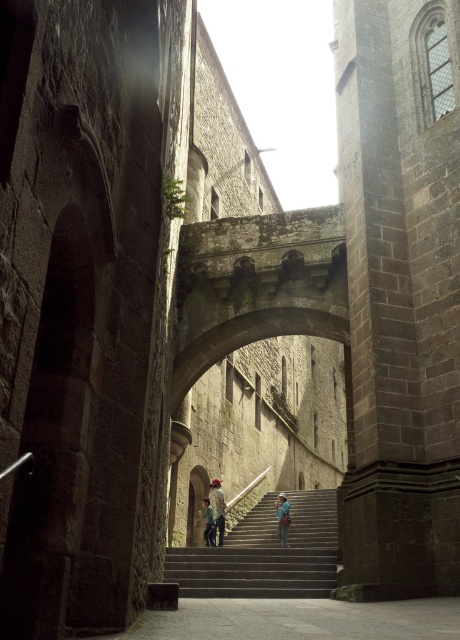
Where is `light blue denim jeans at center`? The image size is (460, 640). light blue denim jeans at center is located at coordinates (218, 508).

Who is more distant from viewer, (214, 516) or (280, 524)?

The point (280, 524) is more distant.

Locate an element on the screen. This screenshot has width=460, height=640. light blue denim jeans at center is located at coordinates (218, 508).

Which is behind, point (216, 531) or point (212, 541)?

The point (216, 531) is more distant.

How far apart are light blue denim jeans at center and green fabric child at center?

light blue denim jeans at center and green fabric child at center are 94.54 centimeters apart from each other.

What do you see at coordinates (218, 508) in the screenshot?
I see `light blue denim jeans at center` at bounding box center [218, 508].

Where is `light blue denim jeans at center`? The height and width of the screenshot is (640, 460). light blue denim jeans at center is located at coordinates (218, 508).

Who is lower down, stone textured stairs at center or blue denim jeans at center?

stone textured stairs at center is lower down.

Who is more forward, (337, 536) or (279, 525)?

Point (337, 536) is more forward.

Where is `stone textured stairs at center`? The height and width of the screenshot is (640, 460). stone textured stairs at center is located at coordinates (264, 554).